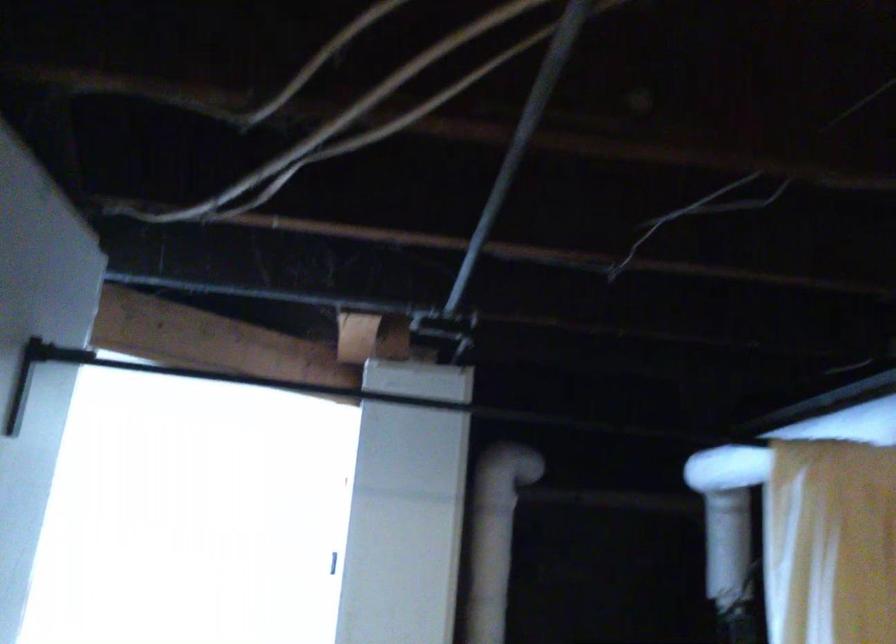
The location [372,397] corresponds to which object?

It corresponds to the black pull-up bar in the image.